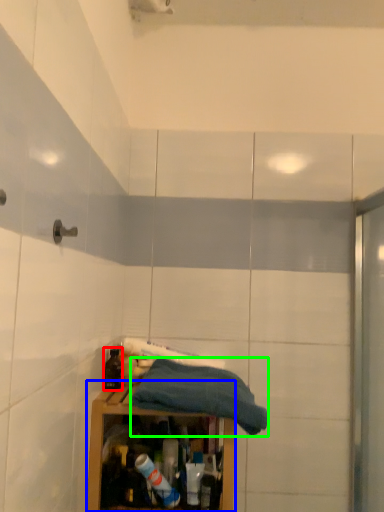
Question: Considering the real-world distances, which object is closest to bottle (highlighted by a red box)? cabinetry (highlighted by a blue box) or towel (highlighted by a green box).

Choices:
 (A) cabinetry
 (B) towel

Answer: (A)